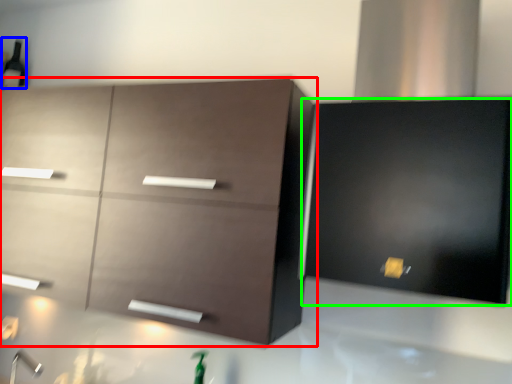
Question: Estimate the real-world distances between objects in this image. Which object is farther from cabinetry (highlighted by a red box), beer bottle (highlighted by a blue box) or cabinetry (highlighted by a green box)?

Choices:
 (A) beer bottle
 (B) cabinetry

Answer: (A)